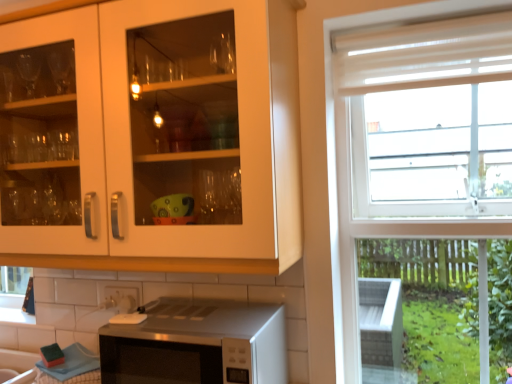
Describe the element at coordinates (197, 344) in the screenshot. I see `satin silver microwave at lower center` at that location.

Describe the element at coordinates (256, 152) in the screenshot. I see `matte white cabinet at upper left` at that location.

I want to click on satin silver microwave at lower center, so click(x=197, y=344).

This screenshot has width=512, height=384. Find the location of `cabinetry above the satin silver microwave at lower center (from a real-world perspective)`. cabinetry above the satin silver microwave at lower center (from a real-world perspective) is located at coordinates (256, 152).

Is satin silver microwave at lower center next to matte white cabinet at upper left and touching it?

No, satin silver microwave at lower center is not beside matte white cabinet at upper left.

Looking at this image, considering the relative sizes of satin silver microwave at lower center and matte white cabinet at upper left in the image provided, is satin silver microwave at lower center shorter than matte white cabinet at upper left?

Indeed, satin silver microwave at lower center has a lesser height compared to matte white cabinet at upper left.

Is satin silver microwave at lower center to the left of matte white cabinet at upper left from the viewer's perspective?

No.

Considering the sizes of objects sheer white curtain at upper right and matte white cabinet at upper left in the image provided, who is thinner, sheer white curtain at upper right or matte white cabinet at upper left?

sheer white curtain at upper right is thinner.

From a real-world perspective, is sheer white curtain at upper right positioned under matte white cabinet at upper left based on gravity?

Actually, sheer white curtain at upper right is physically above matte white cabinet at upper left in the real world.

The image size is (512, 384). I want to click on cabinetry lying on the left of sheer white curtain at upper right, so click(256, 152).

How different are the orientations of sheer white curtain at upper right and matte white cabinet at upper left in degrees?

The angular difference between sheer white curtain at upper right and matte white cabinet at upper left is 0.00709 degrees.

Is matte white cabinet at upper left closer to camera compared to white glossy tile at lower center?

Yes, the depth of matte white cabinet at upper left is less than that of white glossy tile at lower center.

Does matte white cabinet at upper left have a larger size compared to white glossy tile at lower center?

Yes, matte white cabinet at upper left is bigger than white glossy tile at lower center.

From a real-world perspective, which object stands above the other?

matte white cabinet at upper left, from a real-world perspective.

Is matte white cabinet at upper left positioned with its back to white glossy tile at lower center?

matte white cabinet at upper left is not turned away from white glossy tile at lower center.

Can you tell me how much sheer white curtain at upper right and satin silver microwave at lower center differ in facing direction?

The angular difference between sheer white curtain at upper right and satin silver microwave at lower center is 0.0105 degrees.

This screenshot has width=512, height=384. There is a satin silver microwave at lower center. What are the coordinates of `curtain above it (from a real-world perspective)` in the screenshot? It's located at (426, 55).

Which of these two, sheer white curtain at upper right or satin silver microwave at lower center, is thinner?

With smaller width is sheer white curtain at upper right.

Consider the image. Is sheer white curtain at upper right to the left of satin silver microwave at lower center from the viewer's perspective?

In fact, sheer white curtain at upper right is to the right of satin silver microwave at lower center.

Consider the image. Considering the relative sizes of satin silver microwave at lower center and white glossy tile at lower center in the image provided, is satin silver microwave at lower center bigger than white glossy tile at lower center?

Indeed, satin silver microwave at lower center has a larger size compared to white glossy tile at lower center.

At what (x,y) coordinates should I click in order to perform the action: click on tile that is on the left side of satin silver microwave at lower center. Please return your answer as a coordinate pair (x, y). Image resolution: width=512 pixels, height=384 pixels. Looking at the image, I should click on (119, 295).

Is satin silver microwave at lower center further to camera compared to white glossy tile at lower center?

No.

Which of these two, satin silver microwave at lower center or white glossy tile at lower center, stands shorter?

With less height is white glossy tile at lower center.

From the picture: Looking at their sizes, would you say white glossy tile at lower center is wider or thinner than satin silver microwave at lower center?

white glossy tile at lower center is thinner than satin silver microwave at lower center.

Considering the positions of objects white glossy tile at lower center and satin silver microwave at lower center in the image provided, who is more to the right, white glossy tile at lower center or satin silver microwave at lower center?

Positioned to the right is satin silver microwave at lower center.

Is satin silver microwave at lower center completely or partially inside white glossy tile at lower center?

No, satin silver microwave at lower center is not a part of white glossy tile at lower center.

Considering the points (141, 285) and (272, 140), which point is behind, point (141, 285) or point (272, 140)?

The point (141, 285) is farther.

Is white glossy tile at lower center in front of or behind matte white cabinet at upper left in the image?

white glossy tile at lower center is behind matte white cabinet at upper left.

Which object is thinner, white glossy tile at lower center or matte white cabinet at upper left?

white glossy tile at lower center.

Considering the positions of objects white glossy tile at lower center and matte white cabinet at upper left in the image provided, who is more to the left, white glossy tile at lower center or matte white cabinet at upper left?

From the viewer's perspective, white glossy tile at lower center appears more on the left side.

Where is `microwave oven on the right of matte white cabinet at upper left`? This screenshot has width=512, height=384. microwave oven on the right of matte white cabinet at upper left is located at coordinates (197, 344).

This screenshot has width=512, height=384. I want to click on cabinetry below the sheer white curtain at upper right (from a real-world perspective), so click(x=256, y=152).

Based on their spatial positions, is white glossy tile at lower center or sheer white curtain at upper right closer to matte white cabinet at upper left?

Based on the image, sheer white curtain at upper right appears to be nearer to matte white cabinet at upper left.

When comparing their distances from white glossy tile at lower center, does matte white cabinet at upper left or sheer white curtain at upper right seem closer?

matte white cabinet at upper left.

Based on the photo, when comparing their distances from satin silver microwave at lower center, does matte white cabinet at upper left or white glossy tile at lower center seem closer?

Based on the image, matte white cabinet at upper left appears to be nearer to satin silver microwave at lower center.

Looking at the image, which one is located further to white glossy tile at lower center, matte white cabinet at upper left or satin silver microwave at lower center?

The object further to white glossy tile at lower center is matte white cabinet at upper left.

Which object lies further to the anchor point satin silver microwave at lower center, sheer white curtain at upper right or matte white cabinet at upper left?

Based on the image, sheer white curtain at upper right appears to be further to satin silver microwave at lower center.

Estimate the real-world distances between objects in this image. Which object is closer to sheer white curtain at upper right, satin silver microwave at lower center or white glossy tile at lower center?

satin silver microwave at lower center lies closer to sheer white curtain at upper right than the other object.

Which object lies nearer to the anchor point sheer white curtain at upper right, matte white cabinet at upper left or white glossy tile at lower center?

matte white cabinet at upper left lies closer to sheer white curtain at upper right than the other object.

When comparing their distances from satin silver microwave at lower center, does white glossy tile at lower center or matte white cabinet at upper left seem further?

white glossy tile at lower center is positioned further to the anchor satin silver microwave at lower center.

I want to click on cabinetry between sheer white curtain at upper right and satin silver microwave at lower center in the up-down direction, so click(x=256, y=152).

Where is `tile between matte white cabinet at upper left and satin silver microwave at lower center vertically`? The width and height of the screenshot is (512, 384). tile between matte white cabinet at upper left and satin silver microwave at lower center vertically is located at coordinates (119, 295).

Where is `microwave oven located between white glossy tile at lower center and sheer white curtain at upper right in the left-right direction`? The width and height of the screenshot is (512, 384). microwave oven located between white glossy tile at lower center and sheer white curtain at upper right in the left-right direction is located at coordinates (197, 344).

This screenshot has width=512, height=384. What are the coordinates of `cabinetry located between white glossy tile at lower center and sheer white curtain at upper right in the left-right direction` in the screenshot? It's located at (256, 152).